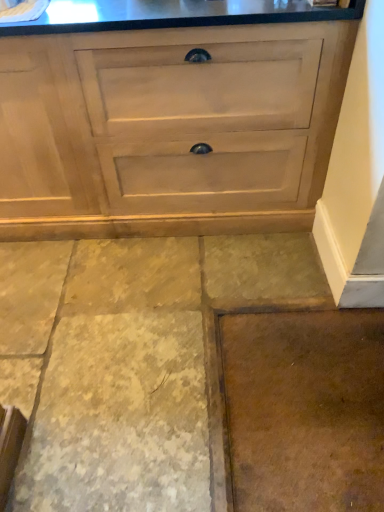
Where is `brown stone floor at lower center, which ranks as the second concrete in right-to-left order`? The image size is (384, 512). brown stone floor at lower center, which ranks as the second concrete in right-to-left order is located at coordinates tap(133, 361).

The height and width of the screenshot is (512, 384). Describe the element at coordinates (305, 409) in the screenshot. I see `brown matte concrete at lower right, the 1th concrete in the right-to-left sequence` at that location.

What are the coordinates of `matte wood chest of drawers at center` in the screenshot? It's located at (168, 129).

Find the location of a particular element. concrete to the left of brown matte concrete at lower right, the 1th concrete in the right-to-left sequence is located at coordinates (133, 361).

From a real-world perspective, which object rests below the other?

In real-world perspective, brown matte concrete at lower right, the 1th concrete in the right-to-left sequence, is lower.

Does point (226, 362) come in front of point (230, 246)?

That is True.

Considering the points (46, 226) and (269, 333), which point is in front, point (46, 226) or point (269, 333)?

Point (269, 333)

Which object is closer to the camera, matte wood chest of drawers at center or brown matte concrete at lower right, the 1th concrete in the right-to-left sequence?

brown matte concrete at lower right, the 1th concrete in the right-to-left sequence, is more forward.

Between matte wood chest of drawers at center and brown matte concrete at lower right, the 1th concrete in the right-to-left sequence, which one has smaller width?

brown matte concrete at lower right, the 1th concrete in the right-to-left sequence.

Considering the sizes of objects brown stone floor at lower center, which ranks as the second concrete in right-to-left order, and matte wood chest of drawers at center in the image provided, who is bigger, brown stone floor at lower center, which ranks as the second concrete in right-to-left order, or matte wood chest of drawers at center?

Bigger between the two is matte wood chest of drawers at center.

Based on the photo, which is nearer, (287, 279) or (113, 148)?

Clearly, point (287, 279) is more distant from the camera than point (113, 148).

Who is shorter, brown stone floor at lower center, which ranks as the second concrete in right-to-left order, or matte wood chest of drawers at center?

Standing shorter between the two is brown stone floor at lower center, which ranks as the second concrete in right-to-left order.

Can you confirm if matte wood chest of drawers at center is positioned to the left of brown stone floor at lower center, which ranks as the second concrete in right-to-left order?

Correct, you'll find matte wood chest of drawers at center to the left of brown stone floor at lower center, which ranks as the second concrete in right-to-left order.

How many degrees apart are the facing directions of matte wood chest of drawers at center and brown stone floor at lower center, which ranks as the second concrete in right-to-left order?

0.555 degrees separate the facing orientations of matte wood chest of drawers at center and brown stone floor at lower center, which ranks as the second concrete in right-to-left order.

In the scene shown: From the image's perspective, is matte wood chest of drawers at center positioned above or below brown stone floor at lower center, marked as the first concrete in a left-to-right arrangement?

Based on their image positions, matte wood chest of drawers at center is located above brown stone floor at lower center, marked as the first concrete in a left-to-right arrangement.

Are matte wood chest of drawers at center and brown stone floor at lower center, which ranks as the second concrete in right-to-left order, beside each other?

matte wood chest of drawers at center is not next to brown stone floor at lower center, which ranks as the second concrete in right-to-left order, and they're not touching.

Can you confirm if brown matte concrete at lower right, the 1th concrete in the right-to-left sequence, is taller than matte wood chest of drawers at center?

No, brown matte concrete at lower right, the 1th concrete in the right-to-left sequence, is not taller than matte wood chest of drawers at center.

Visually, is brown matte concrete at lower right, the 1th concrete in the right-to-left sequence, positioned to the left or to the right of matte wood chest of drawers at center?

brown matte concrete at lower right, the 1th concrete in the right-to-left sequence, is positioned on matte wood chest of drawers at center's right side.

Which is nearer, (349, 403) or (341, 36)?

Point (341, 36)

Is brown stone floor at lower center, which ranks as the second concrete in right-to-left order, positioned before brown matte concrete at lower right, the second concrete from the left?

Yes, it is in front of brown matte concrete at lower right, the second concrete from the left.

Does brown stone floor at lower center, which ranks as the second concrete in right-to-left order, have a larger size compared to brown matte concrete at lower right, the second concrete from the left?

Indeed, brown stone floor at lower center, which ranks as the second concrete in right-to-left order, has a larger size compared to brown matte concrete at lower right, the second concrete from the left.

Is brown stone floor at lower center, which ranks as the second concrete in right-to-left order, turned away from brown matte concrete at lower right, the second concrete from the left?

brown stone floor at lower center, which ranks as the second concrete in right-to-left order, does not have its back to brown matte concrete at lower right, the second concrete from the left.

From the image's perspective, is brown stone floor at lower center, marked as the first concrete in a left-to-right arrangement, positioned above or below brown matte concrete at lower right, the 1th concrete in the right-to-left sequence?

Based on their image positions, brown stone floor at lower center, marked as the first concrete in a left-to-right arrangement, is located above brown matte concrete at lower right, the 1th concrete in the right-to-left sequence.

Find the location of a particular element. The height and width of the screenshot is (512, 384). concrete below the brown stone floor at lower center, marked as the first concrete in a left-to-right arrangement (from a real-world perspective) is located at coordinates (305, 409).

You are a GUI agent. You are given a task and a screenshot of the screen. Output one action in this format:
    pyautogui.click(x=<x>, y=<y>)
    Task: Click on the chest of drawers located above the brown matte concrete at lower right, the second concrete from the left (from the image's perspective)
    Image resolution: width=384 pixels, height=512 pixels.
    Given the screenshot: What is the action you would take?
    pyautogui.click(x=168, y=129)

Considering their positions, is brown matte concrete at lower right, the 1th concrete in the right-to-left sequence, positioned further to matte wood chest of drawers at center than brown stone floor at lower center, marked as the first concrete in a left-to-right arrangement?

brown matte concrete at lower right, the 1th concrete in the right-to-left sequence.

Considering their positions, is brown stone floor at lower center, which ranks as the second concrete in right-to-left order, positioned closer to brown matte concrete at lower right, the 1th concrete in the right-to-left sequence, than matte wood chest of drawers at center?

brown stone floor at lower center, which ranks as the second concrete in right-to-left order.

Considering their positions, is brown stone floor at lower center, marked as the first concrete in a left-to-right arrangement, positioned further to matte wood chest of drawers at center than brown matte concrete at lower right, the 1th concrete in the right-to-left sequence?

brown matte concrete at lower right, the 1th concrete in the right-to-left sequence, is positioned further to the anchor matte wood chest of drawers at center.

Based on their spatial positions, is matte wood chest of drawers at center or brown matte concrete at lower right, the second concrete from the left, further from brown stone floor at lower center, which ranks as the second concrete in right-to-left order?

matte wood chest of drawers at center is further to brown stone floor at lower center, which ranks as the second concrete in right-to-left order.

Looking at the image, which one is located closer to brown matte concrete at lower right, the 1th concrete in the right-to-left sequence, matte wood chest of drawers at center or brown stone floor at lower center, which ranks as the second concrete in right-to-left order?

brown stone floor at lower center, which ranks as the second concrete in right-to-left order, is positioned closer to the anchor brown matte concrete at lower right, the 1th concrete in the right-to-left sequence.

Looking at the image, which one is located closer to brown stone floor at lower center, marked as the first concrete in a left-to-right arrangement, brown matte concrete at lower right, the 1th concrete in the right-to-left sequence, or matte wood chest of drawers at center?

brown matte concrete at lower right, the 1th concrete in the right-to-left sequence, lies closer to brown stone floor at lower center, marked as the first concrete in a left-to-right arrangement, than the other object.

You are a GUI agent. You are given a task and a screenshot of the screen. Output one action in this format:
    pyautogui.click(x=<x>, y=<y>)
    Task: Click on the concrete between matte wood chest of drawers at center and brown matte concrete at lower right, the 1th concrete in the right-to-left sequence, in the up-down direction
    Image resolution: width=384 pixels, height=512 pixels.
    Given the screenshot: What is the action you would take?
    pyautogui.click(x=133, y=361)